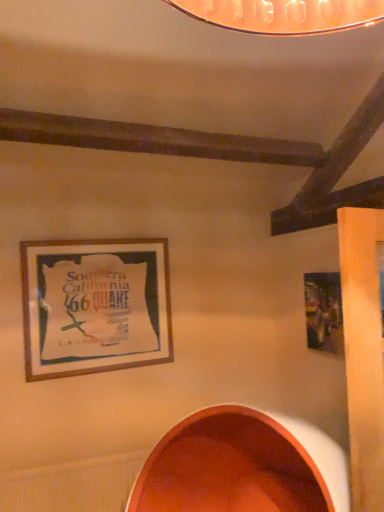
Question: Which is correct: metallic silver picture frame at right, acting as the second picture frame starting from the left, is inside wooden frame at upper left, placed as the second picture frame when sorted from right to left, or outside of it?

Choices:
 (A) inside
 (B) outside

Answer: (B)

Question: From a real-world perspective, is metallic silver picture frame at right, acting as the second picture frame starting from the left, positioned above or below wooden frame at upper left, placed as the second picture frame when sorted from right to left?

Choices:
 (A) above
 (B) below

Answer: (B)

Question: Which of these objects is positioned farthest from the metallic silver picture frame at right, positioned as the 1th picture frame in right-to-left order?

Choices:
 (A) wooden frame at upper left, placed as the second picture frame when sorted from right to left
 (B) matte orange bowl at lower center

Answer: (A)

Question: Which object is the closest to the metallic silver picture frame at right, acting as the second picture frame starting from the left?

Choices:
 (A) wooden frame at upper left, the first picture frame positioned from the left
 (B) matte orange bowl at lower center

Answer: (B)